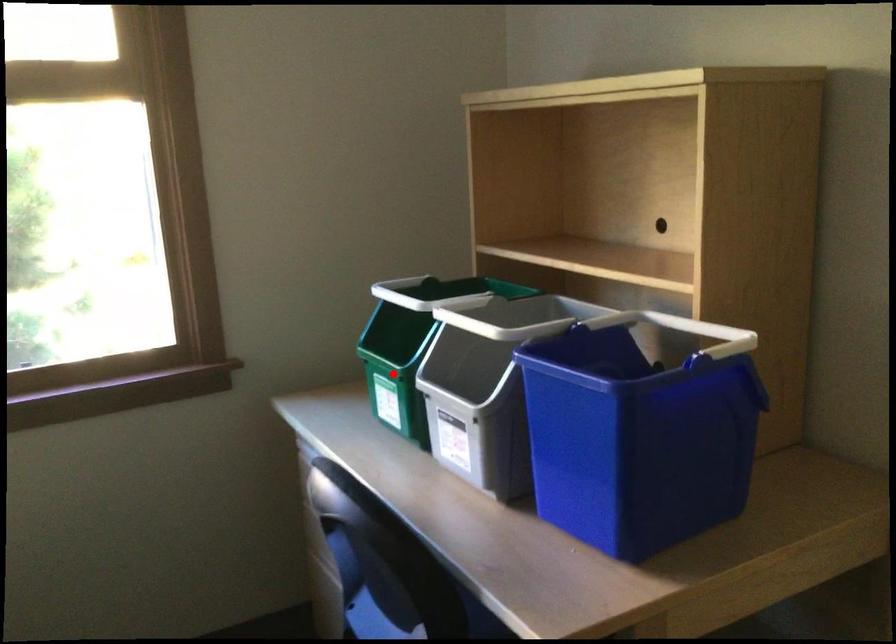
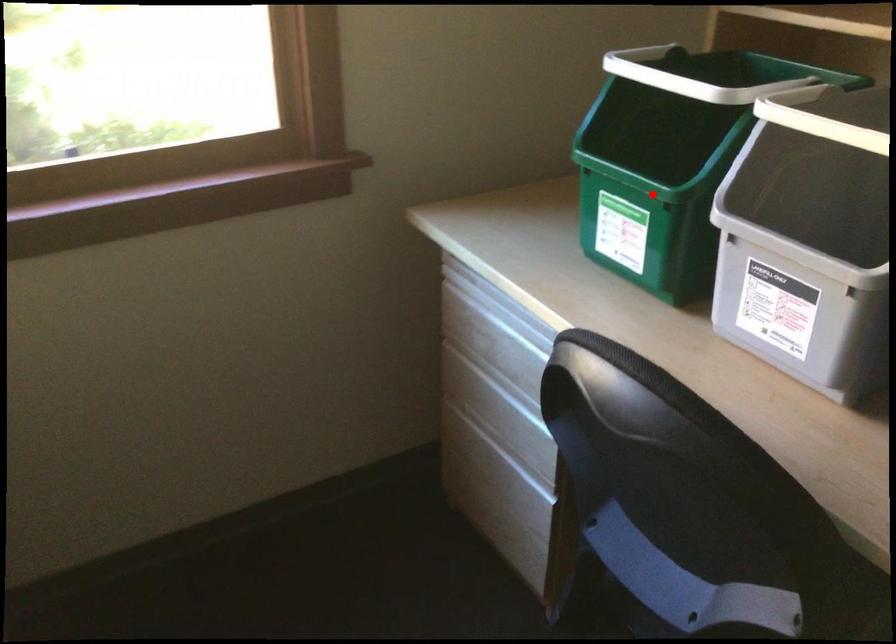
I am providing you with two images of the same scene from different viewpoints. A red point is marked on the first image and another point is marked on the second image. Is the marked point in image1 the same physical position as the marked point in image2?

Yes